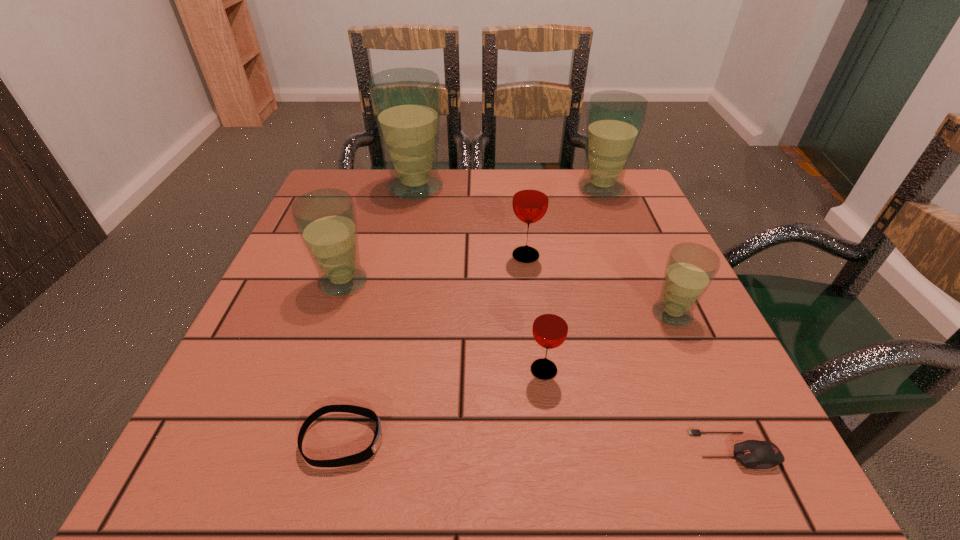
Where is `free region that satisfies the following two spatial constraints: 1. on the front side of the nearer red glass; 2. on the right side of the mouse`? The width and height of the screenshot is (960, 540). free region that satisfies the following two spatial constraints: 1. on the front side of the nearer red glass; 2. on the right side of the mouse is located at coordinates (554, 450).

Find the location of a particular element. blank space that satisfies the following two spatial constraints: 1. on the back side of the second tallest glass; 2. on the left side of the third biggest blue glass is located at coordinates (375, 188).